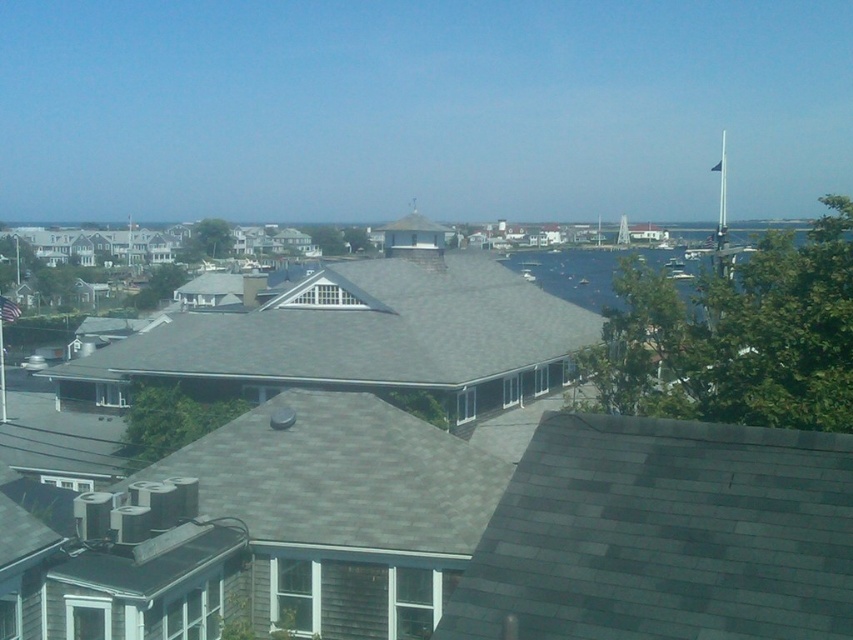
Question: Is gray shingles at center positioned at the back of dark blue water at right?

Choices:
 (A) yes
 (B) no

Answer: (A)

Question: Does gray shingles at center appear on the left side of dark blue water at right?

Choices:
 (A) no
 (B) yes

Answer: (B)

Question: Which object appears farthest from the camera in this image?

Choices:
 (A) gray shingles at center
 (B) dark blue water at right

Answer: (A)

Question: Does gray shingles at center appear on the right side of dark blue water at right?

Choices:
 (A) yes
 (B) no

Answer: (B)

Question: Which object is farther from the camera taking this photo?

Choices:
 (A) dark blue water at right
 (B) gray shingles at center

Answer: (B)